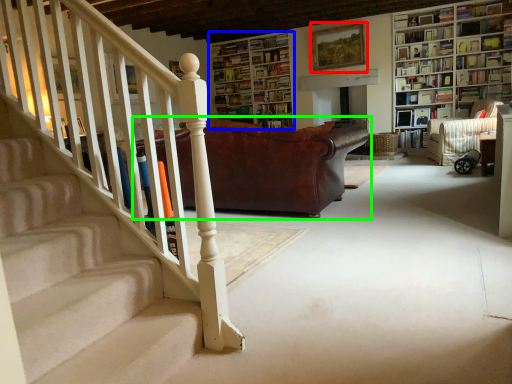
Question: Which is farther away from picture frame (highlighted by a red box)? bookcase (highlighted by a blue box) or studio couch (highlighted by a green box)?

Choices:
 (A) bookcase
 (B) studio couch

Answer: (B)